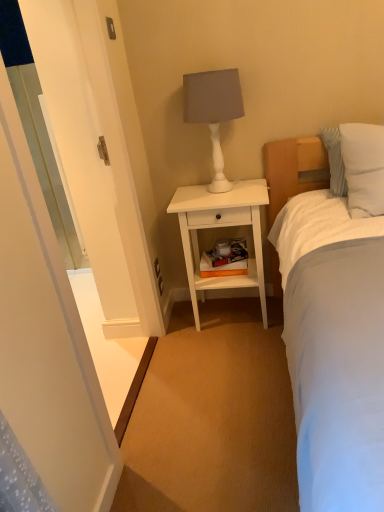
Find the location of a particular element. This screenshot has height=512, width=384. vacant area on top of white matte nightstand at center (from a real-world perspective) is located at coordinates (217, 190).